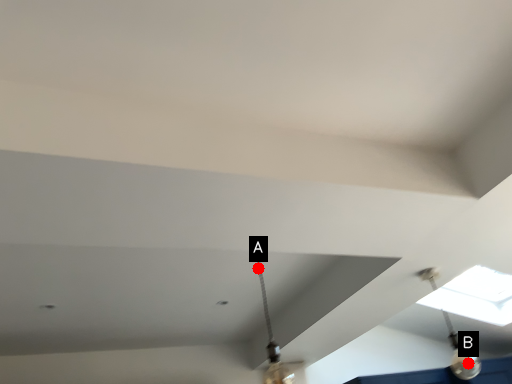
Question: Two points are circled on the image, labeled by A and B beside each circle. Which point is farther from the camera taking this photo?

Choices:
 (A) A is further
 (B) B is further

Answer: (B)